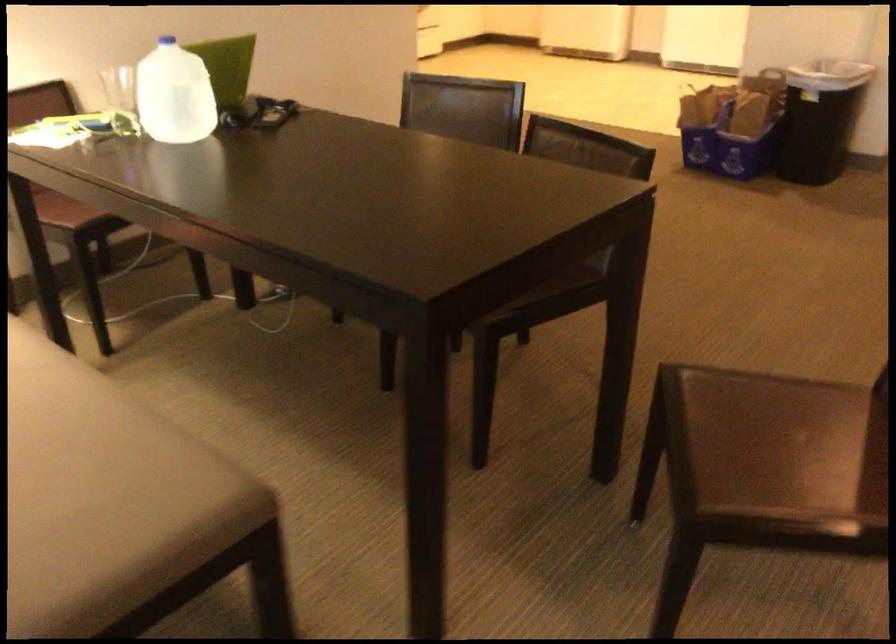
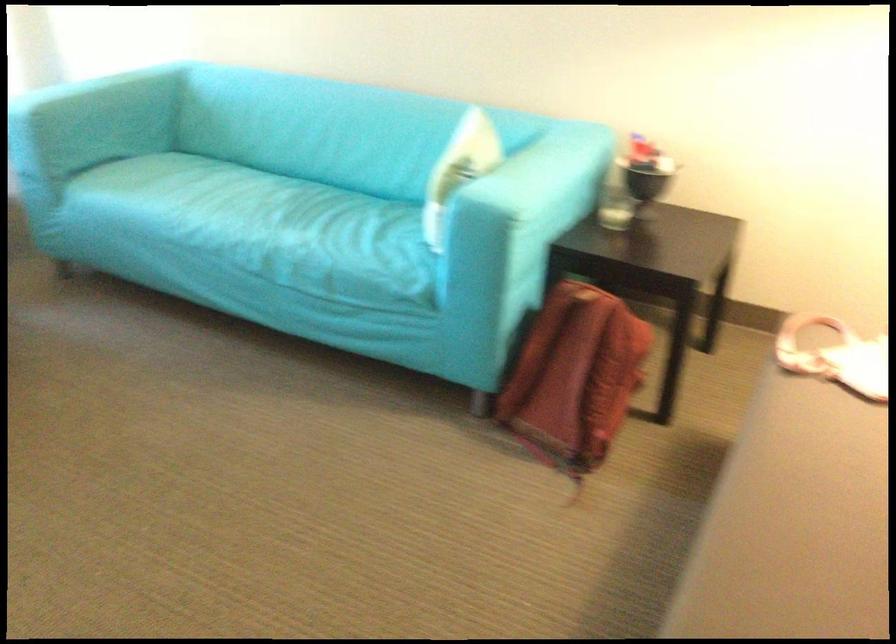
Based on the continuous images, in which direction is the camera rotating?

The rotation direction of the camera is left-down.